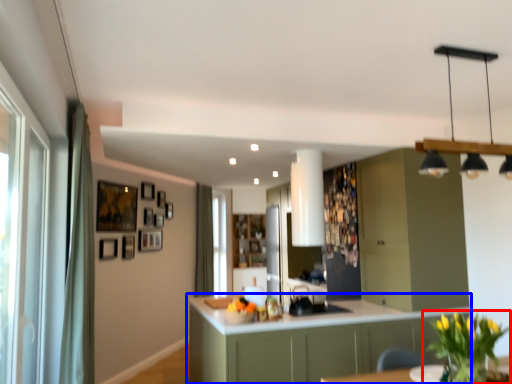
Question: Which of the following is the farthest to the observer, houseplant (highlighted by a red box) or cabinetry (highlighted by a blue box)?

Choices:
 (A) houseplant
 (B) cabinetry

Answer: (B)